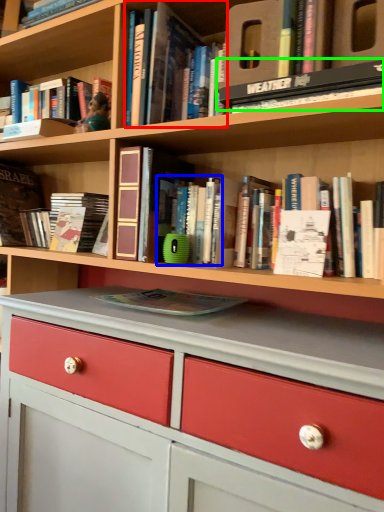
Question: Which is farther away from book (highlighted by a red box)? book (highlighted by a blue box) or book (highlighted by a green box)?

Choices:
 (A) book
 (B) book

Answer: (A)